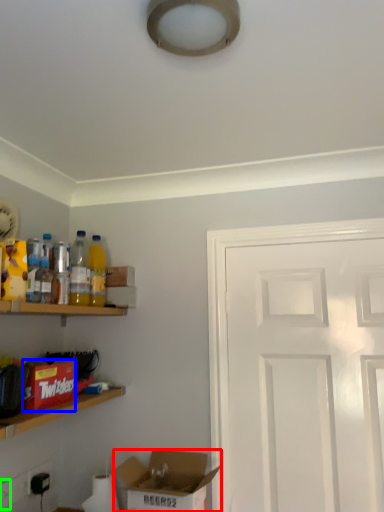
Question: Considering the real-world distances, which object is closest to box (highlighted by a red box)? box (highlighted by a blue box) or electric outlet (highlighted by a green box).

Choices:
 (A) box
 (B) electric outlet

Answer: (A)